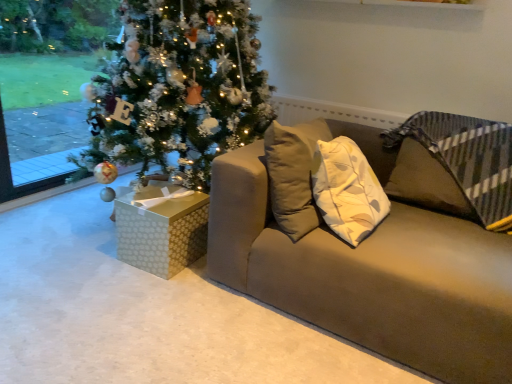
This screenshot has width=512, height=384. I want to click on free space in front of gold-patterned gift box at lower left, so click(x=148, y=290).